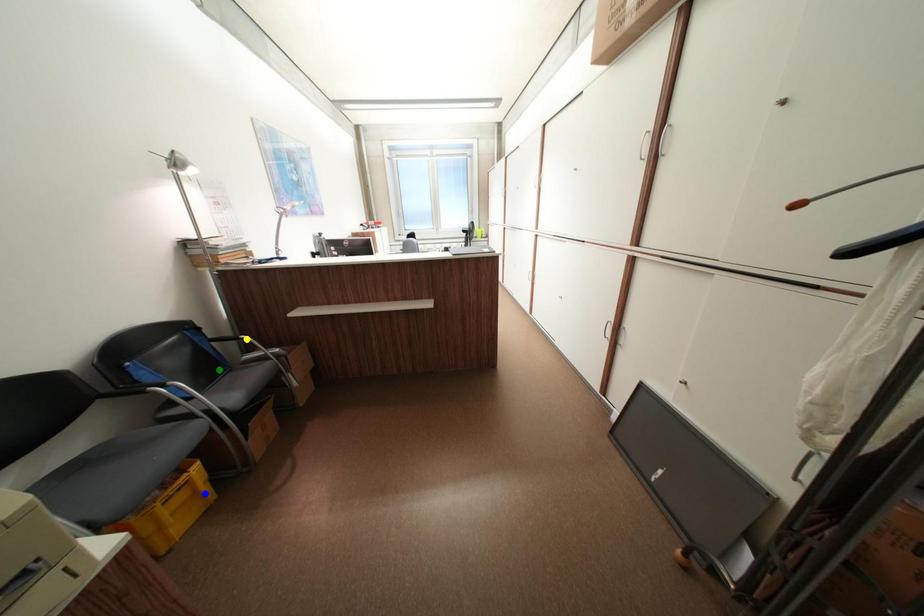
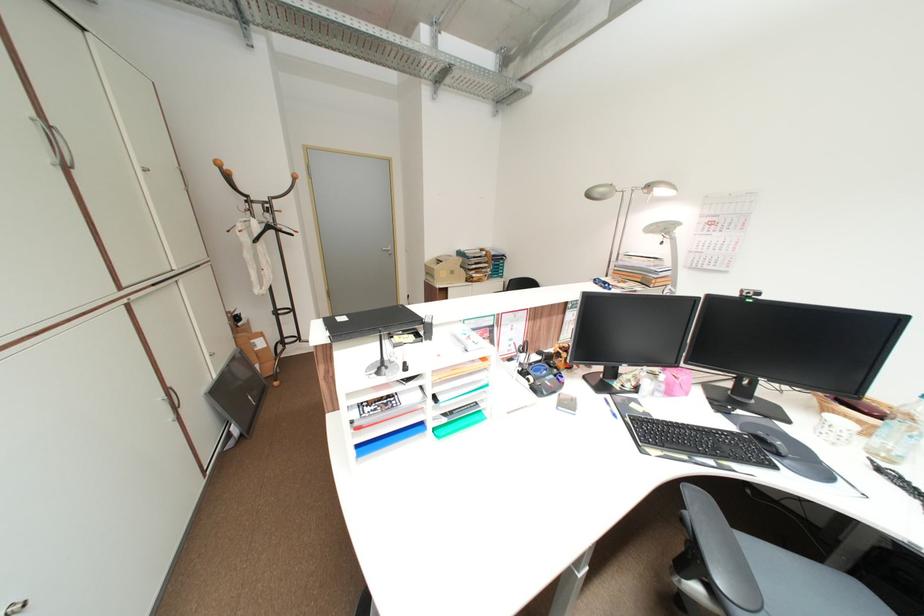
I am providing you with two images of the same scene from different viewpoints. Three points are marked in image1. Which point corresponds to a part or object that is occluded in image2?In image1, three points are marked. Which of them correspond to a part or object that is occluded in image2?Among the three points shown in image1, which one corresponds to a part or object that is no longer visible due to occlusion in image2?

blue point, yellow point, green point